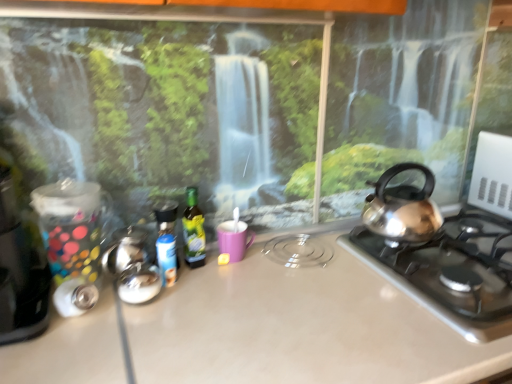
Question: From a real-world perspective, is matte purple mug at center positioned above or below satin silver gas stove at right?

Choices:
 (A) below
 (B) above

Answer: (B)

Question: In the image, is matte purple mug at center positioned in front of or behind satin silver gas stove at right?

Choices:
 (A) behind
 (B) front

Answer: (A)

Question: Which object is positioned closest to the metallic silver canister at left?

Choices:
 (A) matte purple mug at center
 (B) green glass bottle at center, arranged as the 1th bottle when viewed from the right
 (C) satin silver gas stove at right
 (D) matte beige countertop at center
 (E) blue plastic bottle at center, arranged as the second bottle when viewed from the right

Answer: (E)

Question: Which object is the closest to the matte purple mug at center?

Choices:
 (A) metallic silver canister at left
 (B) green glass bottle at center, arranged as the 1th bottle when viewed from the right
 (C) blue plastic bottle at center, arranged as the second bottle when viewed from the right
 (D) satin silver gas stove at right
 (E) matte beige countertop at center

Answer: (B)